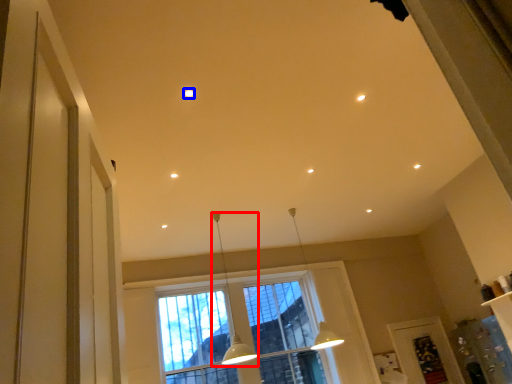
Question: Which of the following is the farthest to the observer, lamp (highlighted by a red box) or lighting (highlighted by a blue box)?

Choices:
 (A) lamp
 (B) lighting

Answer: (A)